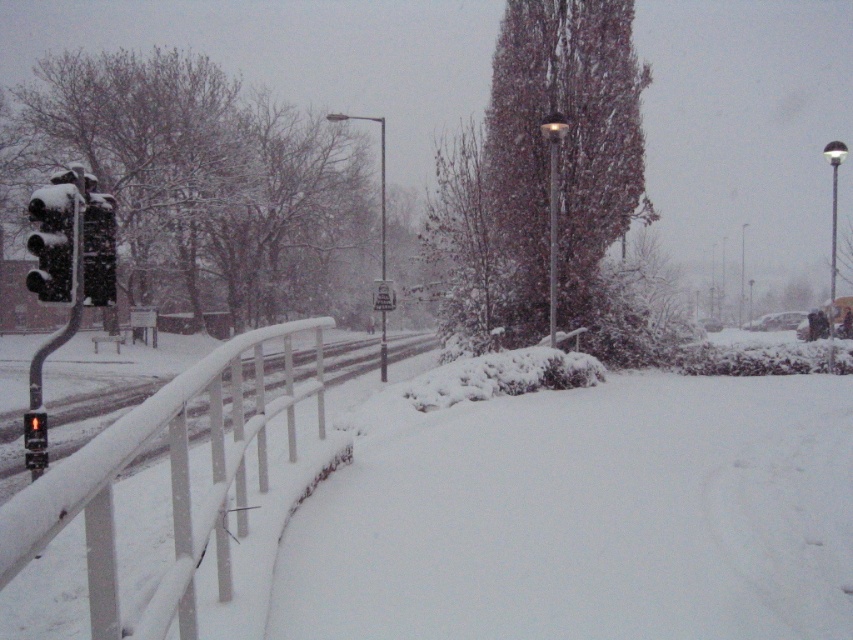
Between matte black traffic light at left and black matte traffic light at left, which one is positioned lower?

black matte traffic light at left is lower down.

Is matte black traffic light at left above black matte traffic light at left?

Indeed, matte black traffic light at left is positioned over black matte traffic light at left.

Locate an element on the screen. matte black traffic light at left is located at coordinates (54, 241).

Is white fluffy snow at center to the right of metallic pole at center from the viewer's perspective?

Correct, you'll find white fluffy snow at center to the right of metallic pole at center.

Can you confirm if white fluffy snow at center is positioned below metallic pole at center?

Correct, white fluffy snow at center is located below metallic pole at center.

This screenshot has height=640, width=853. What are the coordinates of `white fluffy snow at center` in the screenshot? It's located at (589, 516).

At what (x,y) coordinates should I click in order to perform the action: click on white fluffy snow at center. Please return your answer as a coordinate pair (x, y). Image resolution: width=853 pixels, height=640 pixels. Looking at the image, I should click on (589, 516).

Can you confirm if white fluffy snow at center is taller than matte black traffic light at left?

In fact, white fluffy snow at center may be shorter than matte black traffic light at left.

Does point (558, 586) come farther from viewer compared to point (38, 291)?

No, it is in front of (38, 291).

Is point (544, 561) farther from viewer compared to point (45, 211)?

No, (544, 561) is closer to viewer.

The image size is (853, 640). I want to click on white fluffy snow at center, so (x=589, y=516).